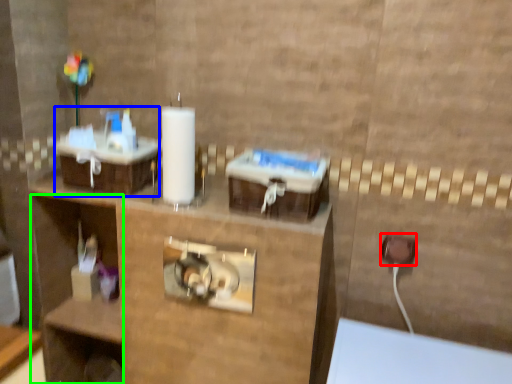
Question: Based on their relative distances, which object is nearer to electric outlet (highlighted by a red box)? Choose from sink (highlighted by a blue box) and shelf (highlighted by a green box).

Choices:
 (A) sink
 (B) shelf

Answer: (A)